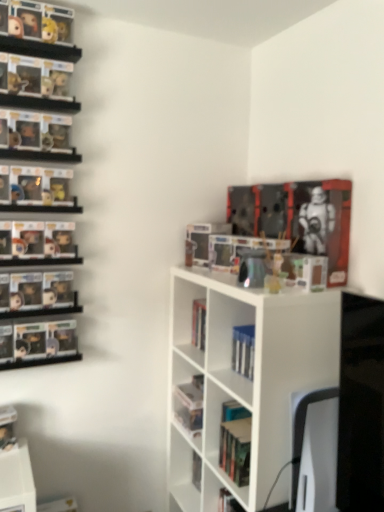
Image resolution: width=384 pixels, height=512 pixels. What do you see at coordinates (242, 381) in the screenshot? I see `white matte bookshelf at center` at bounding box center [242, 381].

This screenshot has width=384, height=512. In order to click on metallic silver robot at upper right, the first book in the top-to-bottom sequence in this screenshot , I will do `click(298, 218)`.

Find the location of a particular element. white matte bookshelf at center is located at coordinates (242, 381).

Considering the points (172, 360) and (243, 348), which point is in front, point (172, 360) or point (243, 348)?

Positioned in front is point (243, 348).

Find the location of a particular element. shelf below the blue hardcover book at center, the 1th book ordered from the bottom (from the image's perspective) is located at coordinates (242, 381).

From the image's perspective, which object appears higher, white matte bookshelf at center or blue hardcover book at center, acting as the 1th book starting from the left?

From the image's view, blue hardcover book at center, acting as the 1th book starting from the left, is above.

Is white matte bookshelf at center placed right next to blue hardcover book at center, acting as the 1th book starting from the left?

white matte bookshelf at center is not next to blue hardcover book at center, acting as the 1th book starting from the left, and they're not touching.

Is blue hardcover book at center, which is counted as the 2th book, starting from the top, at the left side of white matte bookshelf at center?

Indeed, blue hardcover book at center, which is counted as the 2th book, starting from the top, is positioned on the left side of white matte bookshelf at center.

Would you say blue hardcover book at center, the 1th book ordered from the bottom, contains white matte bookshelf at center?

Definitely not — white matte bookshelf at center is not inside blue hardcover book at center, the 1th book ordered from the bottom.

Which is less distant, [241,370] or [247,321]?

The point [241,370] is closer to the camera.

Is metallic silver robot at upper right, the first book in the top-to-bottom sequence, next to blue hardcover book at center, acting as the 1th book starting from the left, and touching it?

Result: No, metallic silver robot at upper right, the first book in the top-to-bottom sequence, is not touching blue hardcover book at center, acting as the 1th book starting from the left.

From the image's perspective, which is above, metallic silver robot at upper right, placed as the second book when sorted from bottom to top, or blue hardcover book at center, the 1th book ordered from the bottom?

metallic silver robot at upper right, placed as the second book when sorted from bottom to top, appears higher in the image.

From a real-world perspective, who is located higher, metallic silver robot at upper right, the first book in the top-to-bottom sequence, or blue hardcover book at center, which is counted as the 2th book, starting from the top?

metallic silver robot at upper right, the first book in the top-to-bottom sequence.

Between metallic silver robot at upper right, which ranks as the first book in right-to-left order, and blue hardcover book at center, the 1th book ordered from the bottom, which one appears on the left side from the viewer's perspective?

From the viewer's perspective, blue hardcover book at center, the 1th book ordered from the bottom, appears more on the left side.

From a real-world perspective, relative to metallic silver robot at upper right, placed as the second book when sorted from bottom to top, is white matte bookshelf at center vertically above or below?

In terms of real-world spatial position, white matte bookshelf at center is below metallic silver robot at upper right, placed as the second book when sorted from bottom to top.

What's the angular difference between white matte bookshelf at center and metallic silver robot at upper right, placed as the second book when sorted from bottom to top,'s facing directions?

12 degrees.

Does white matte bookshelf at center have a greater width compared to metallic silver robot at upper right, the first book in the top-to-bottom sequence?

Indeed, white matte bookshelf at center has a greater width compared to metallic silver robot at upper right, the first book in the top-to-bottom sequence.

Between point (252, 342) and point (334, 197), which one is positioned in front?

The point (252, 342) is closer to the camera.

Considering the relative positions of blue hardcover book at center, which is counted as the 2th book, starting from the right, and metallic silver robot at upper right, the first book in the top-to-bottom sequence, in the image provided, is blue hardcover book at center, which is counted as the 2th book, starting from the right, to the left or to the right of metallic silver robot at upper right, the first book in the top-to-bottom sequence,?

blue hardcover book at center, which is counted as the 2th book, starting from the right, is to the left of metallic silver robot at upper right, the first book in the top-to-bottom sequence.

How distant is blue hardcover book at center, acting as the 1th book starting from the left, from metallic silver robot at upper right, the first book in the top-to-bottom sequence?

They are 18.54 inches apart.

Considering the relative sizes of blue hardcover book at center, which is counted as the 2th book, starting from the top, and metallic silver robot at upper right, which ranks as the first book in right-to-left order, in the image provided, is blue hardcover book at center, which is counted as the 2th book, starting from the top, shorter than metallic silver robot at upper right, which ranks as the first book in right-to-left order,?

Yes, blue hardcover book at center, which is counted as the 2th book, starting from the top, is shorter than metallic silver robot at upper right, which ranks as the first book in right-to-left order.

The image size is (384, 512). I want to click on book that is the 2nd one above the white matte bookshelf at center (from a real-world perspective), so click(298, 218).

Is white matte bookshelf at center located within metallic silver robot at upper right, placed as the second book when sorted from bottom to top?

No, white matte bookshelf at center is not a part of metallic silver robot at upper right, placed as the second book when sorted from bottom to top.

Considering the positions of point (294, 234) and point (261, 397), is point (294, 234) closer or farther from the camera than point (261, 397)?

Clearly, point (294, 234) is more distant from the camera than point (261, 397).

Which of these two, metallic silver robot at upper right, the first book in the top-to-bottom sequence, or white matte bookshelf at center, is wider?

white matte bookshelf at center is wider.

Identify the location of shelf directly beneath the blue hardcover book at center, which is counted as the 2th book, starting from the top (from a real-world perspective). (242, 381).

Find the location of a particular element. This screenshot has width=384, height=512. book on the left of the white matte bookshelf at center is located at coordinates (243, 350).

Looking at the image, which one is located closer to metallic silver robot at upper right, which is the 2th book in left-to-right order, white matte bookshelf at center or blue hardcover book at center, which is counted as the 2th book, starting from the right?

white matte bookshelf at center lies closer to metallic silver robot at upper right, which is the 2th book in left-to-right order, than the other object.

Based on their spatial positions, is white matte bookshelf at center or metallic silver robot at upper right, placed as the second book when sorted from bottom to top, closer to blue hardcover book at center, the 1th book ordered from the bottom?

white matte bookshelf at center is positioned closer to the anchor blue hardcover book at center, the 1th book ordered from the bottom.

When comparing their distances from blue hardcover book at center, which is counted as the 2th book, starting from the right, does metallic silver robot at upper right, the first book in the top-to-bottom sequence, or white matte bookshelf at center seem closer?

white matte bookshelf at center is closer to blue hardcover book at center, which is counted as the 2th book, starting from the right.

Estimate the real-world distances between objects in this image. Which object is closer to white matte bookshelf at center, blue hardcover book at center, acting as the 1th book starting from the left, or metallic silver robot at upper right, the first book in the top-to-bottom sequence?

The object closer to white matte bookshelf at center is blue hardcover book at center, acting as the 1th book starting from the left.

Looking at the image, which one is located further to white matte bookshelf at center, metallic silver robot at upper right, the first book in the top-to-bottom sequence, or blue hardcover book at center, which is counted as the 2th book, starting from the right?

Based on the image, metallic silver robot at upper right, the first book in the top-to-bottom sequence, appears to be further to white matte bookshelf at center.

Looking at the image, which one is located further to metallic silver robot at upper right, which is the 2th book in left-to-right order, blue hardcover book at center, which is counted as the 2th book, starting from the top, or white matte bookshelf at center?

Based on the image, blue hardcover book at center, which is counted as the 2th book, starting from the top, appears to be further to metallic silver robot at upper right, which is the 2th book in left-to-right order.

Where is `book between metallic silver robot at upper right, which ranks as the first book in right-to-left order, and white matte bookshelf at center vertically`? The height and width of the screenshot is (512, 384). book between metallic silver robot at upper right, which ranks as the first book in right-to-left order, and white matte bookshelf at center vertically is located at coordinates (243, 350).